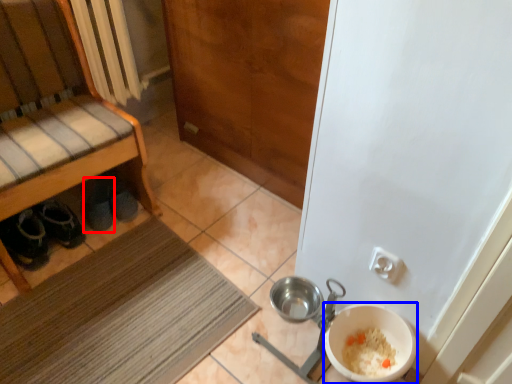
Question: Which point is closer to the camera, footwear (highlighted by a red box) or basin (highlighted by a blue box)?

Choices:
 (A) footwear
 (B) basin

Answer: (B)